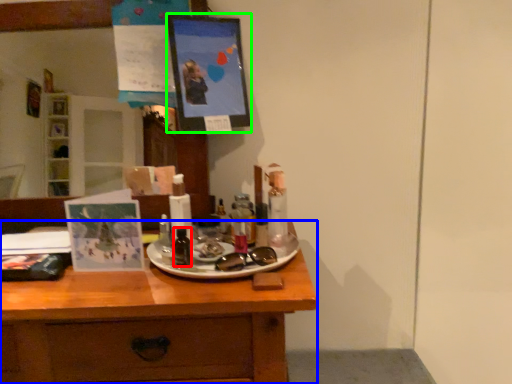
Question: Which object is the closest to the toiletry (highlighted by a red box)? Choose among these: desk (highlighted by a blue box) or picture frame (highlighted by a green box).

Choices:
 (A) desk
 (B) picture frame

Answer: (A)